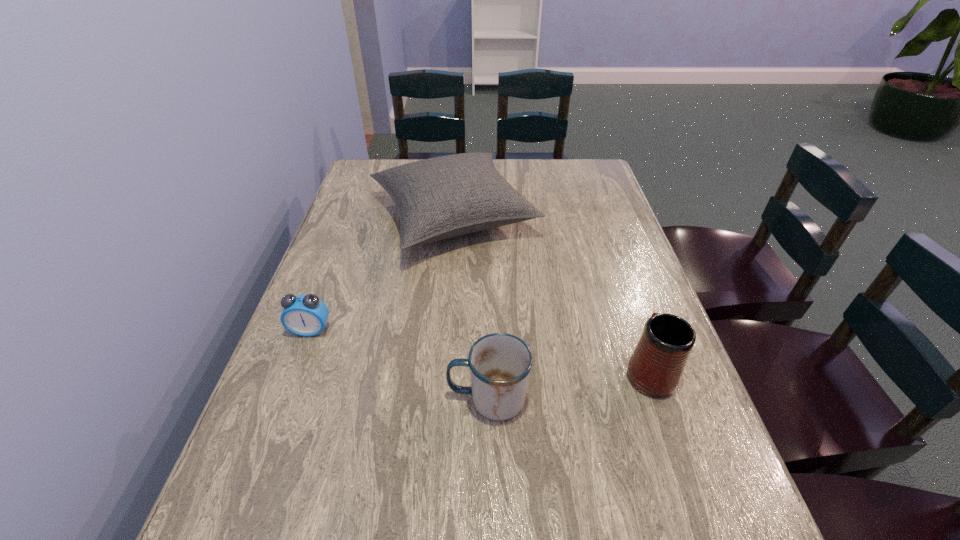
Where is `cushion`? Image resolution: width=960 pixels, height=540 pixels. cushion is located at coordinates (443, 197).

Find the location of a particular element. the right mug is located at coordinates (656, 366).

At what (x,y) coordinates should I click in order to perform the action: click on the left mug. Please return your answer as a coordinate pair (x, y). Looking at the image, I should click on (500, 363).

The image size is (960, 540). Identify the location of alarm clock. (305, 315).

In order to click on the shortest object in this screenshot , I will do `click(305, 315)`.

Locate an element on the screen. Image resolution: width=960 pixels, height=540 pixels. free space located on the back of the cushion is located at coordinates (458, 160).

Where is `free space located 0.330m on the side of the rightmost object with the handle`? This screenshot has height=540, width=960. free space located 0.330m on the side of the rightmost object with the handle is located at coordinates (608, 250).

Find the location of a particular element. free region located on the side of the rightmost object with the handle is located at coordinates (604, 241).

Find the location of a particular element. free space located on the side of the rightmost object with the handle is located at coordinates pyautogui.click(x=613, y=267).

This screenshot has height=540, width=960. Find the location of `vacant space located on the handle side of the left mug`. vacant space located on the handle side of the left mug is located at coordinates (396, 399).